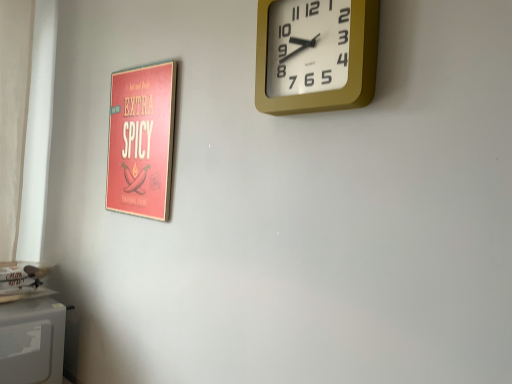
Question: Considering the positions of point (32, 342) and point (148, 162), is point (32, 342) closer or farther from the camera than point (148, 162)?

Choices:
 (A) farther
 (B) closer

Answer: (A)

Question: Visually, is white matte microwave at lower left positioned to the left or to the right of matte red poster at left?

Choices:
 (A) right
 (B) left

Answer: (B)

Question: Estimate the real-world distances between objects in this image. Which object is closer to the matte red poster at left?

Choices:
 (A) white matte microwave at lower left
 (B) gold metallic wall clock at upper right

Answer: (B)

Question: Estimate the real-world distances between objects in this image. Which object is closer to the matte red poster at left?

Choices:
 (A) white matte microwave at lower left
 (B) gold metallic wall clock at upper right

Answer: (B)